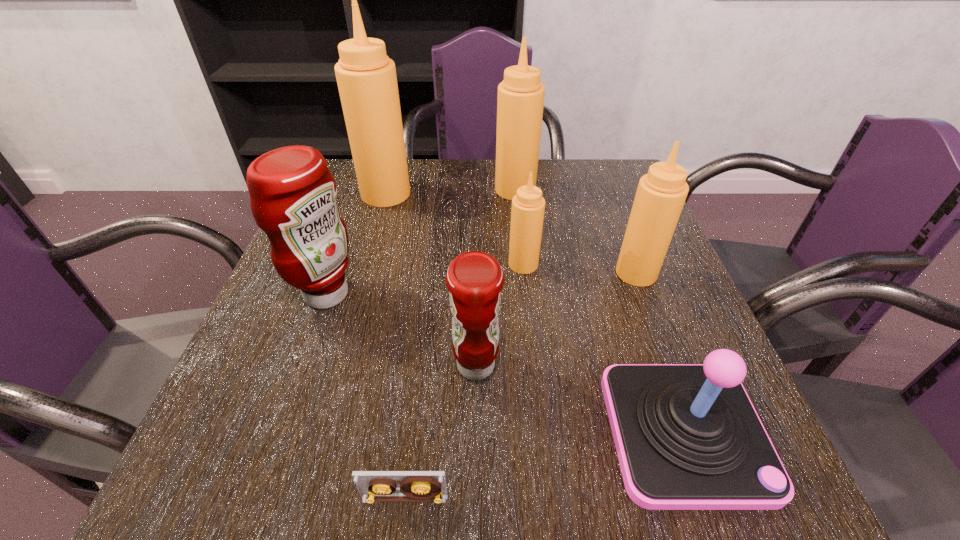
The width and height of the screenshot is (960, 540). I want to click on the leftmost tan condiment, so click(366, 77).

The image size is (960, 540). Find the location of `the tallest condiment`. the tallest condiment is located at coordinates point(366,77).

Where is `the fifth shortest condiment`? This screenshot has width=960, height=540. the fifth shortest condiment is located at coordinates click(x=520, y=101).

Find the location of a particular element. the second biggest tan condiment is located at coordinates (520, 101).

The height and width of the screenshot is (540, 960). Find the location of `the rightmost tan condiment`. the rightmost tan condiment is located at coordinates (661, 194).

Locate an element on the screen. This screenshot has height=540, width=960. the second smallest tan condiment is located at coordinates (661, 194).

You are a GUI agent. You are given a task and a screenshot of the screen. Output one action in this format:
    pyautogui.click(x=<x>, y=<y>)
    Task: Click on the farther red condiment
    
    Given the screenshot: What is the action you would take?
    pyautogui.click(x=293, y=193)

Where is `the bigger red condiment`? Image resolution: width=960 pixels, height=540 pixels. the bigger red condiment is located at coordinates (293, 193).

I want to click on the smallest tan condiment, so click(527, 214).

The image size is (960, 540). Identify the location of the smaller red condiment. (474, 279).